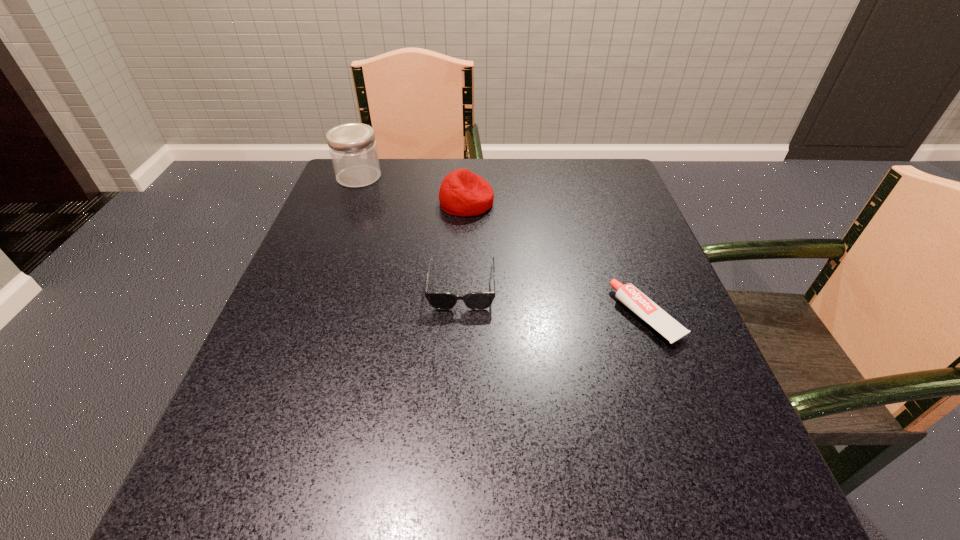
Locate an element on the screen. The height and width of the screenshot is (540, 960). jar is located at coordinates (352, 146).

Identify the location of the tallest object. The height and width of the screenshot is (540, 960). (352, 146).

Locate an element on the screen. the third shortest object is located at coordinates (462, 193).

Image resolution: width=960 pixels, height=540 pixels. I want to click on sunglasses, so click(x=439, y=300).

Where is `toothpaste`? Image resolution: width=960 pixels, height=540 pixels. toothpaste is located at coordinates (628, 294).

Where is `the shortest object`? the shortest object is located at coordinates (628, 294).

Locate an element on the screen. vacant space positioned 0.300m on the front of the leftmost object is located at coordinates (324, 267).

Locate an element on the screen. free spot located on the seat area of the beanbag is located at coordinates (620, 202).

Find the location of a particular element. vacant region located at the front lenses of the sunglasses is located at coordinates (453, 496).

The image size is (960, 540). In order to click on free location located 0.400m on the left of the rightmost object in this screenshot , I will do `click(397, 316)`.